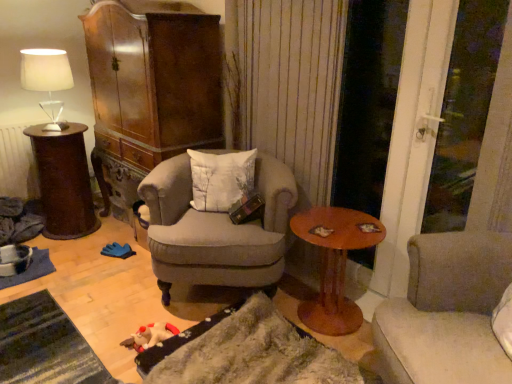
Question: Can you see light gray fabric armchair at center touching dark brown wooden side table at left, which is counted as the second table, starting from the right?

Choices:
 (A) yes
 (B) no

Answer: (B)

Question: From the image's perspective, would you say light gray fabric armchair at center is shown under dark brown wooden side table at left, which is counted as the second table, starting from the right?

Choices:
 (A) yes
 (B) no

Answer: (A)

Question: Considering the relative sizes of light gray fabric armchair at center and dark brown wooden side table at left, which is counted as the second table, starting from the right, in the image provided, is light gray fabric armchair at center shorter than dark brown wooden side table at left, which is counted as the second table, starting from the right,?

Choices:
 (A) yes
 (B) no

Answer: (B)

Question: Considering the relative positions of light gray fabric armchair at center and dark brown wooden side table at left, arranged as the second table when viewed from the front, in the image provided, is light gray fabric armchair at center to the right of dark brown wooden side table at left, arranged as the second table when viewed from the front, from the viewer's perspective?

Choices:
 (A) no
 (B) yes

Answer: (B)

Question: From a real-world perspective, is light gray fabric armchair at center on top of dark brown wooden side table at left, positioned as the 1th table in back-to-front order?

Choices:
 (A) no
 (B) yes

Answer: (A)

Question: Is light gray fabric armchair at center facing away from dark brown wooden side table at left, arranged as the second table when viewed from the front?

Choices:
 (A) no
 (B) yes

Answer: (A)

Question: Is white textured pillow at center further to camera compared to dark brown wooden side table at left, which is counted as the second table, starting from the right?

Choices:
 (A) no
 (B) yes

Answer: (A)

Question: Is dark brown wooden side table at left, which is counted as the second table, starting from the right, at the back of white textured pillow at center?

Choices:
 (A) yes
 (B) no

Answer: (B)

Question: Could you tell me if white textured pillow at center is facing dark brown wooden side table at left, positioned as the 1th table in back-to-front order?

Choices:
 (A) no
 (B) yes

Answer: (A)

Question: From the image's perspective, is white textured pillow at center below dark brown wooden side table at left, which is counted as the second table, starting from the right?

Choices:
 (A) yes
 (B) no

Answer: (A)

Question: Does white textured pillow at center have a lesser height compared to dark brown wooden side table at left, which is counted as the second table, starting from the right?

Choices:
 (A) no
 (B) yes

Answer: (B)

Question: Can you confirm if white textured pillow at center is taller than dark brown wooden side table at left, arranged as the second table when viewed from the front?

Choices:
 (A) no
 (B) yes

Answer: (A)

Question: Is dark brown wooden side table at left, arranged as the second table when viewed from the front, at the left side of wooden round table at center, acting as the 1th table starting from the right?

Choices:
 (A) no
 (B) yes

Answer: (B)